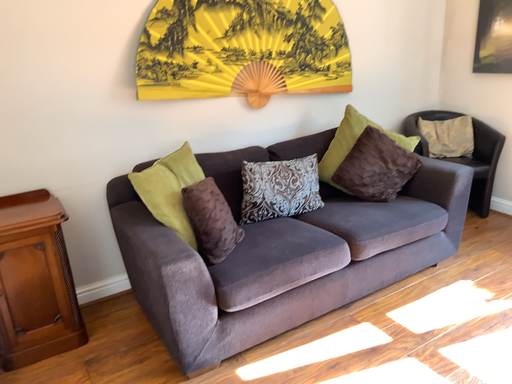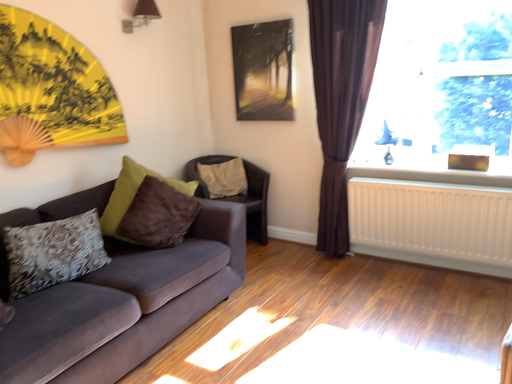
Question: How did the camera likely rotate when shooting the video?

Choices:
 (A) rotated upward
 (B) rotated downward

Answer: (A)